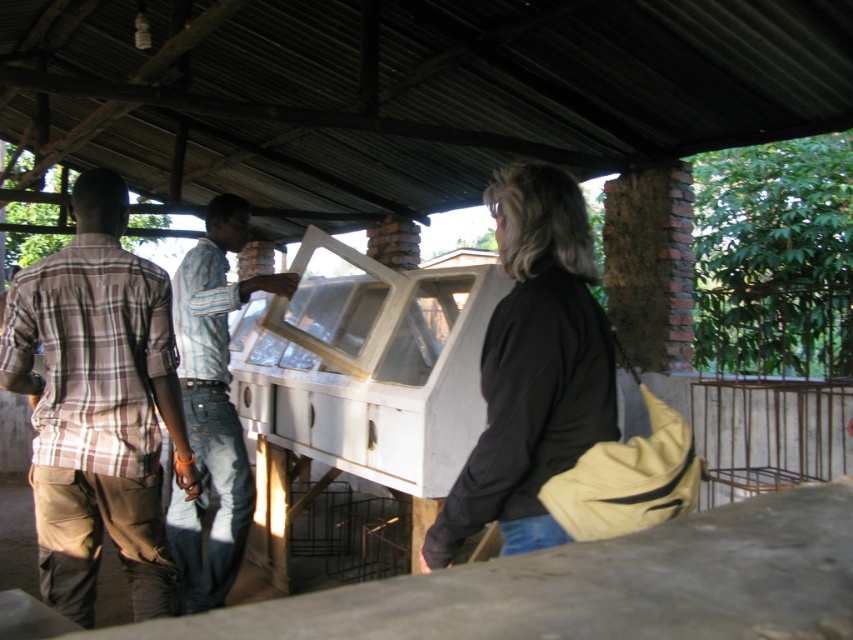
Where is the plaid cotton shirt at left located in the image?

The plaid cotton shirt at left is located at point (97, 404) in the image.

Based on the photo, you are standing in the rural area under the corrugated metal roof and see two people wearing the black matte jacket at center and the striped shirt at center. Which person is shorter?

The black matte jacket at center has a lesser height compared to striped shirt at center, so the person wearing the black matte jacket at center is shorter.

You are standing at the base of the corrugated metal roof structure and want to walk to the point marked as point (508, 461). Which direction should you go relative to the point marked as point (190, 568)?

You should walk towards the point marked as point (508, 461), which is closer to you than the point marked as point (190, 568). Since you want to reach the closer point, you should head in the direction of point (508, 461) rather than the farther point (190, 568).